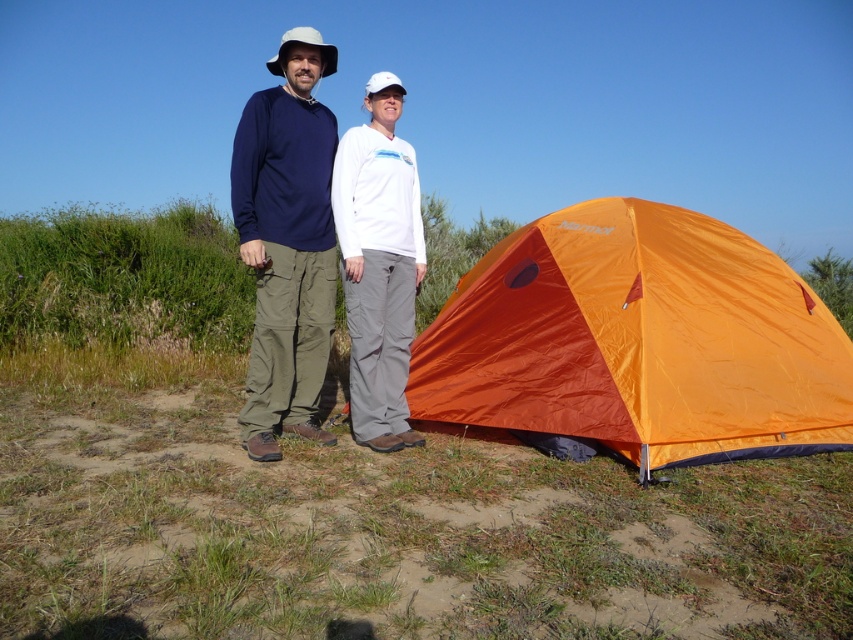
Is orange nylon tent at lower right wider than white matte pants at center?

Correct, the width of orange nylon tent at lower right exceeds that of white matte pants at center.

Does orange nylon tent at lower right come behind white matte pants at center?

No.

This screenshot has height=640, width=853. Find the location of `orange nylon tent at lower right`. orange nylon tent at lower right is located at coordinates (637, 340).

Between point (817, 340) and point (312, 250), which one is positioned behind?

Point (817, 340)

Does orange nylon tent at lower right have a lesser width compared to matte blue shirt at center?

No, orange nylon tent at lower right is not thinner than matte blue shirt at center.

Which is behind, point (645, 456) or point (276, 205)?

The point (276, 205) is behind.

You are a GUI agent. You are given a task and a screenshot of the screen. Output one action in this format:
    pyautogui.click(x=<x>, y=<y>)
    Task: Click on the orange nylon tent at lower right
    The width and height of the screenshot is (853, 640).
    Given the screenshot: What is the action you would take?
    pyautogui.click(x=637, y=340)

Does matte blue shirt at center have a smaller size compared to white matte pants at center?

Result: Actually, matte blue shirt at center might be larger than white matte pants at center.

Is matte blue shirt at center bigger than white matte pants at center?

Yes.

Is point (300, 68) positioned behind point (393, 275)?

No, (300, 68) is in front of (393, 275).

You are a GUI agent. You are given a task and a screenshot of the screen. Output one action in this format:
    pyautogui.click(x=<x>, y=<y>)
    Task: Click on the matte blue shirt at center
    The height and width of the screenshot is (640, 853).
    Given the screenshot: What is the action you would take?
    pyautogui.click(x=286, y=243)